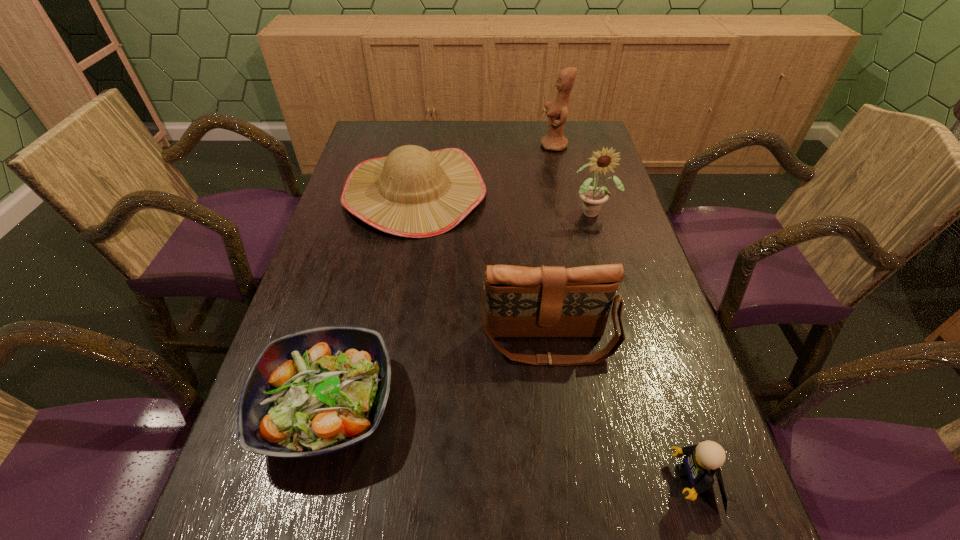
You are a GUI agent. You are given a task and a screenshot of the screen. Output one action in this format:
    pyautogui.click(x=<x>, y=<y>)
    Task: Click on the vacant space located 0.320m on the front-facing side of the sunflower
    
    Given the screenshot: What is the action you would take?
    pyautogui.click(x=623, y=316)

Find the location of a particular element. This screenshot has width=960, height=540. vacant region located 0.300m on the front-facing side of the shoulder bag is located at coordinates (574, 538).

You are a GUI agent. You are given a task and a screenshot of the screen. Output one action in this format:
    pyautogui.click(x=<x>, y=<y>)
    Task: Click on the vacant space located 0.100m on the front of the sunhat
    The height and width of the screenshot is (540, 960).
    Given the screenshot: What is the action you would take?
    pyautogui.click(x=401, y=267)

I want to click on free space located 0.360m on the front-facing side of the Lego, so click(452, 480).

Locate an element on the screen. This screenshot has width=960, height=540. vacant space located on the front-facing side of the Lego is located at coordinates (525, 480).

At what (x,y) coordinates should I click in order to perform the action: click on free point located on the front-facing side of the Lego. Please return your answer as a coordinate pair (x, y). Looking at the image, I should click on (604, 480).

This screenshot has height=540, width=960. What are the coordinates of `vacant space located 0.350m on the back of the shortest object` in the screenshot? It's located at (372, 237).

At what (x,y) coordinates should I click in order to perform the action: click on figurine positioned at the far edge. Please return your answer as a coordinate pair (x, y). Looking at the image, I should click on (557, 111).

I want to click on sunhat that is at the far edge, so (413, 192).

Where is `sunhat positioned at the left edge`? sunhat positioned at the left edge is located at coordinates (413, 192).